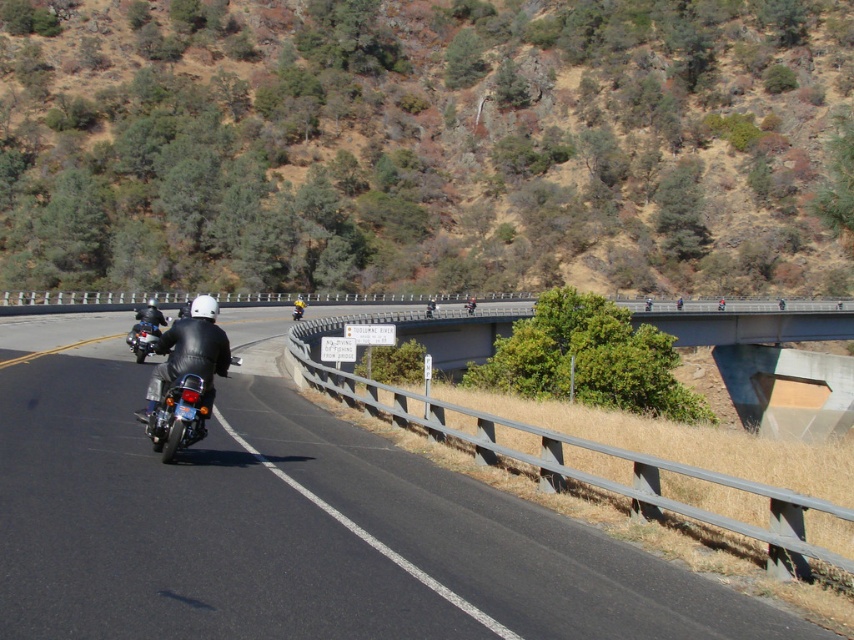
Is green leafy hillside at upper center wider than shiny black leather jacket at center?

Yes, green leafy hillside at upper center is wider than shiny black leather jacket at center.

The width and height of the screenshot is (854, 640). Describe the element at coordinates (427, 145) in the screenshot. I see `green leafy hillside at upper center` at that location.

Where is `green leafy hillside at upper center`? green leafy hillside at upper center is located at coordinates (427, 145).

Which of these two, shiny black leather jacket at center or shiny chrome motorcycle at left, stands shorter?

Standing shorter between the two is shiny black leather jacket at center.

Can you confirm if shiny black leather jacket at center is taller than shiny chrome motorcycle at left?

No, shiny black leather jacket at center is not taller than shiny chrome motorcycle at left.

Who is more distant from viewer, (x=186, y=445) or (x=161, y=333)?

The point (x=161, y=333) is more distant.

At what (x,y) coordinates should I click in order to perform the action: click on shiny black leather jacket at center. Please return your answer as a coordinate pair (x, y). The image size is (854, 640). Looking at the image, I should click on (185, 378).

Does green leafy hillside at upper center appear on the right side of concrete bridge at upper center?

No, green leafy hillside at upper center is not to the right of concrete bridge at upper center.

Identify the location of green leafy hillside at upper center. (427, 145).